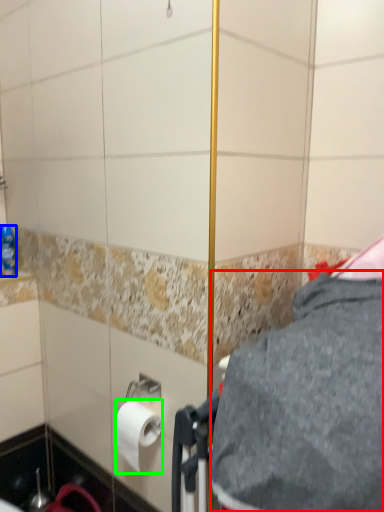
Question: Considering the real-world distances, which object is closest to gray (highlighted by a red box)? bottle (highlighted by a blue box) or toilet paper (highlighted by a green box).

Choices:
 (A) bottle
 (B) toilet paper

Answer: (B)